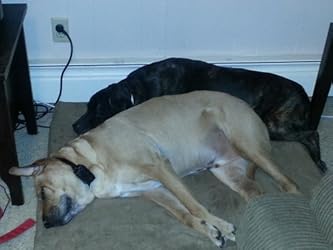
The width and height of the screenshot is (333, 250). What are the coordinates of `white wall` in the screenshot? It's located at (179, 16).